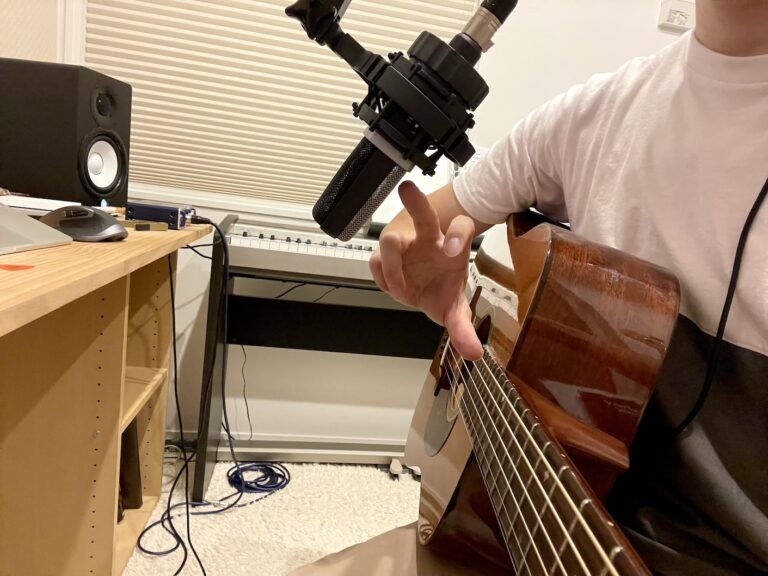
This screenshot has width=768, height=576. Identify the location of blinded window. (253, 98).